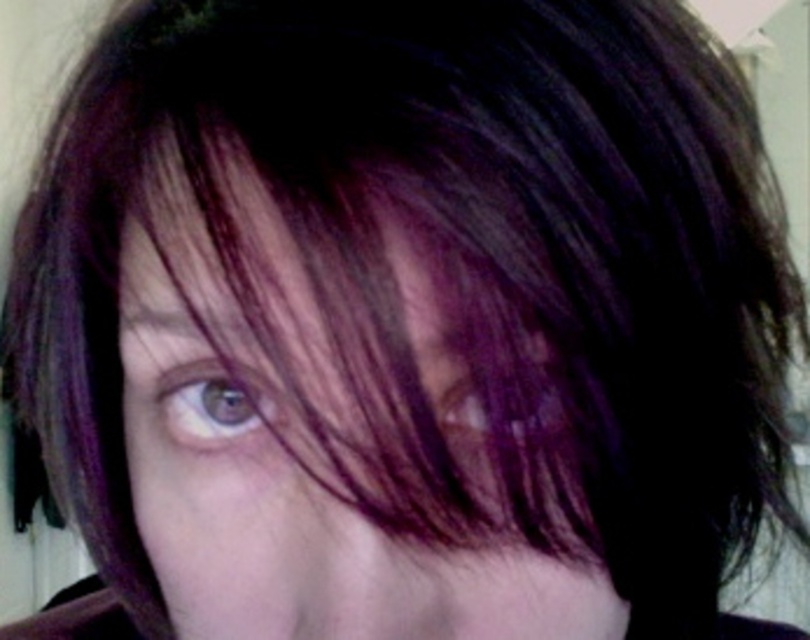
You are a hairstylist trying to style the purple hair at center and the purple shiny hair at center. Which of the two has a greater width?

The purple hair at center has a greater width than the purple shiny hair at center.

You are a photographer adjusting lighting for a portrait. You notice the brown matte eye at center and the purple shiny hair at center. Which object is closer to the camera?

The brown matte eye at center is closer to the camera because the purple shiny hair at center is behind it.